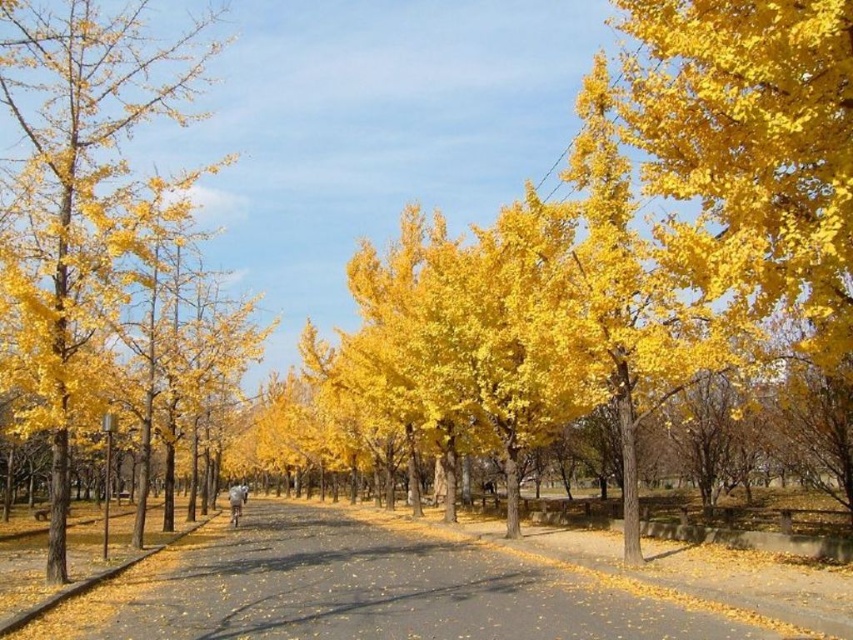
Question: Among these points, which one is nearest to the camera?

Choices:
 (A) (157, 188)
 (B) (300, 637)

Answer: (B)

Question: Does yellow asphalt road at center appear on the right side of yellow leafy tree at left?

Choices:
 (A) no
 (B) yes

Answer: (B)

Question: Does yellow asphalt road at center appear over yellow leafy tree at left?

Choices:
 (A) no
 (B) yes

Answer: (A)

Question: Which point is farther to the camera?

Choices:
 (A) yellow leafy tree at left
 (B) yellow asphalt road at center

Answer: (A)

Question: Does yellow asphalt road at center appear on the left side of yellow leafy tree at left?

Choices:
 (A) no
 (B) yes

Answer: (A)